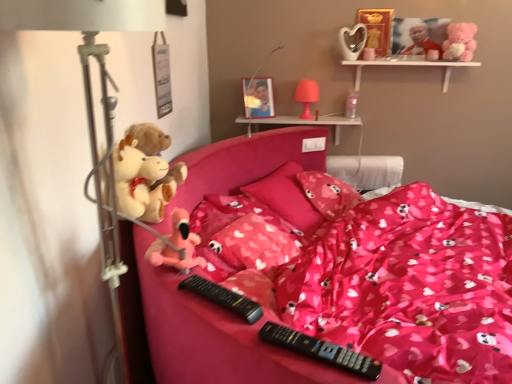
Find the location of `free spot to the right of pink plastic table lamp at upper center, the 1th table lamp positioned from the right`. free spot to the right of pink plastic table lamp at upper center, the 1th table lamp positioned from the right is located at coordinates (335, 119).